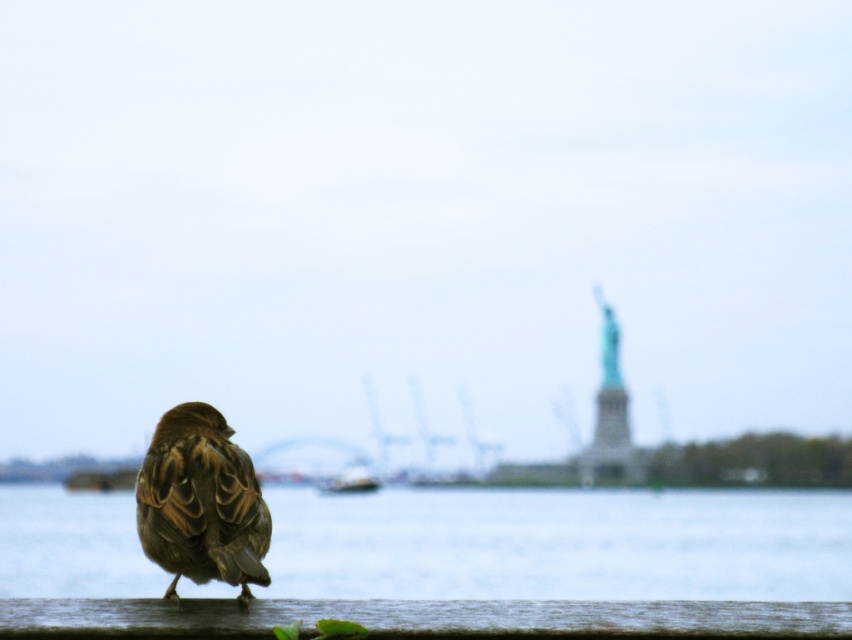
Can you confirm if brown wooden rail at lower center is shorter than white plastic boat at center?

Indeed, brown wooden rail at lower center has a lesser height compared to white plastic boat at center.

Measure the distance between brown wooden rail at lower center and camera.

brown wooden rail at lower center and camera are 9.20 meters apart.

Where is `brown wooden rail at lower center`? brown wooden rail at lower center is located at coordinates (422, 618).

In the scene shown: Is brown feathered sparrow at lower left bigger than white plastic boat at center?

Yes.

Image resolution: width=852 pixels, height=640 pixels. What do you see at coordinates (200, 502) in the screenshot?
I see `brown feathered sparrow at lower left` at bounding box center [200, 502].

The width and height of the screenshot is (852, 640). I want to click on brown feathered sparrow at lower left, so click(200, 502).

Does brown wooden rail at lower center appear on the left side of brown feathered sparrow at lower left?

In fact, brown wooden rail at lower center is to the right of brown feathered sparrow at lower left.

Which is in front, point (12, 634) or point (235, 536)?

Point (12, 634) is more forward.

I want to click on brown wooden rail at lower center, so click(422, 618).